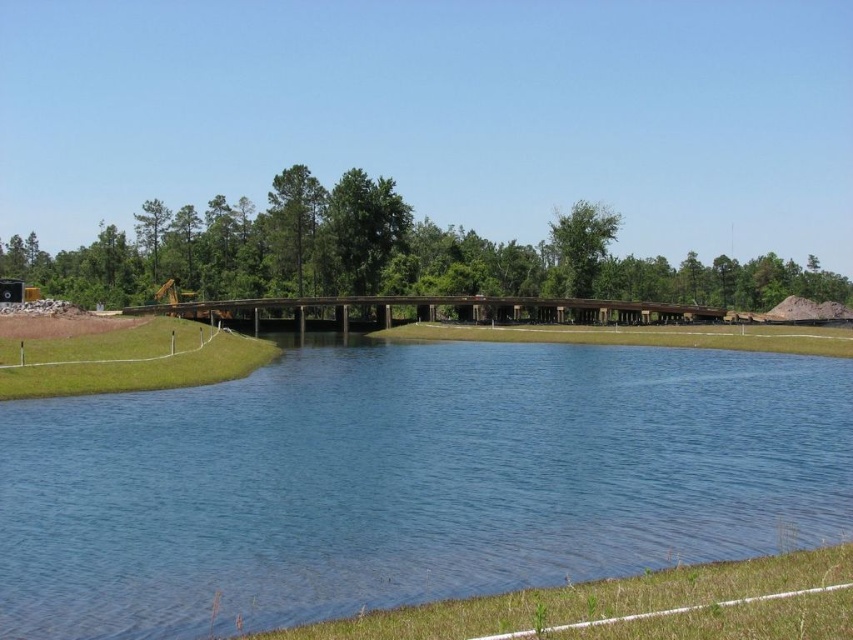
You are standing at the edge of the scene and want to walk towards the blue water at center. Which direction should you move relative to the green grass at lower right?

To reach the blue water at center, you should move towards the center of the scene away from the green grass at lower right since the blue water at center is further to the viewer than the green grass at lower right.

You are standing on the wooden bridge and looking down. You see the blue water at center and the green grass at lower right. Which one is larger in size?

The blue water at center is bigger than the green grass at lower right.